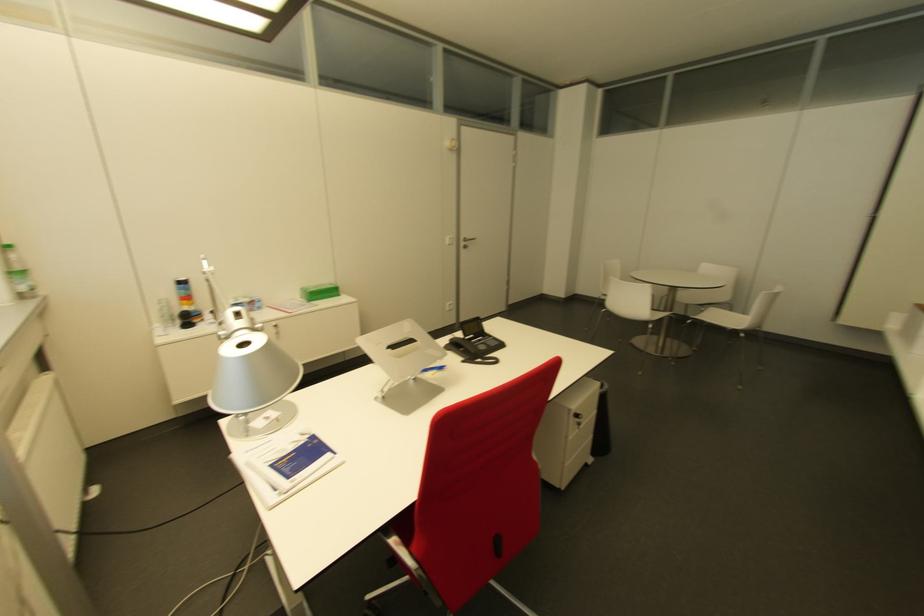
Where would you adjust the silver lamp head? Please return your answer as a coordinate pair (x, y).

(253, 384)